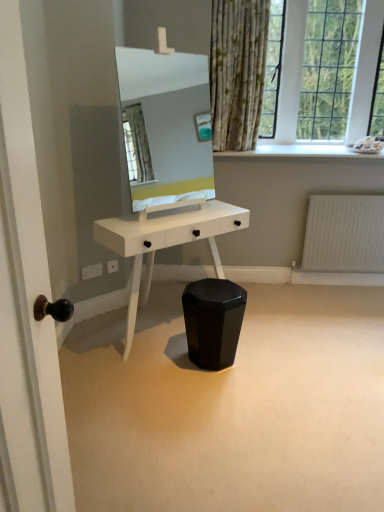
Where is `vacant space in front of white matte radiator at lower right`? The width and height of the screenshot is (384, 512). vacant space in front of white matte radiator at lower right is located at coordinates (349, 302).